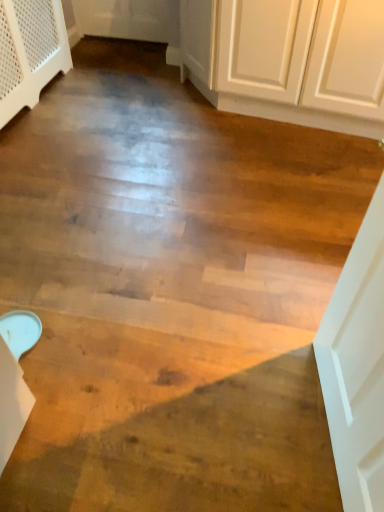
At what (x,y) coordinates should I click in order to perform the action: click on free space underneath white textured dresser at upper left (from a real-world perspective). Please return your answer as a coordinate pair (x, y). The width and height of the screenshot is (384, 512). Looking at the image, I should click on (40, 99).